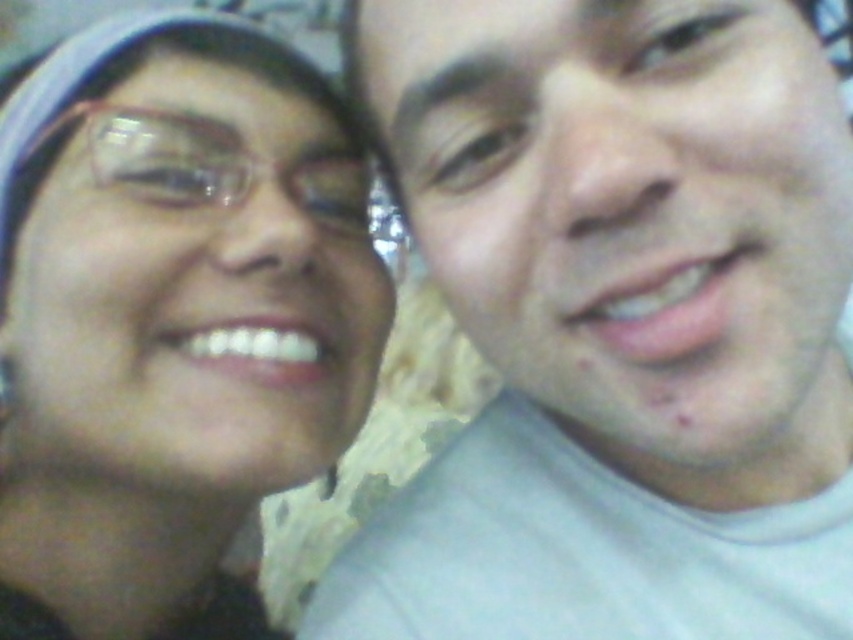
Is matte gray shirt at right positioned at the back of matte black glasses at upper left?

No.

Consider the image. Does matte gray shirt at right appear under matte black glasses at upper left?

Incorrect, matte gray shirt at right is not positioned below matte black glasses at upper left.

Who is more forward, (554, 621) or (142, 403)?

Point (142, 403)

Where is `matte gray shirt at right`? The image size is (853, 640). matte gray shirt at right is located at coordinates (619, 321).